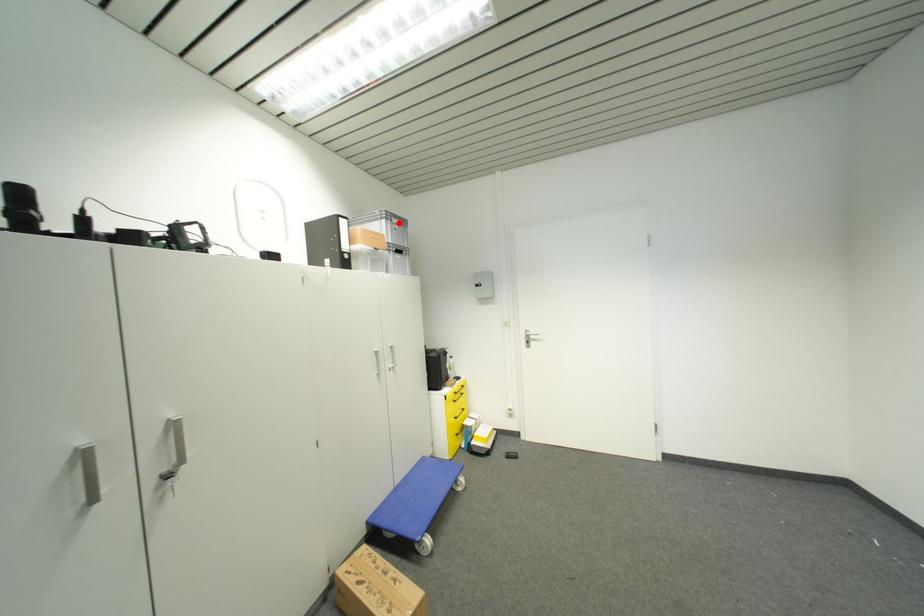
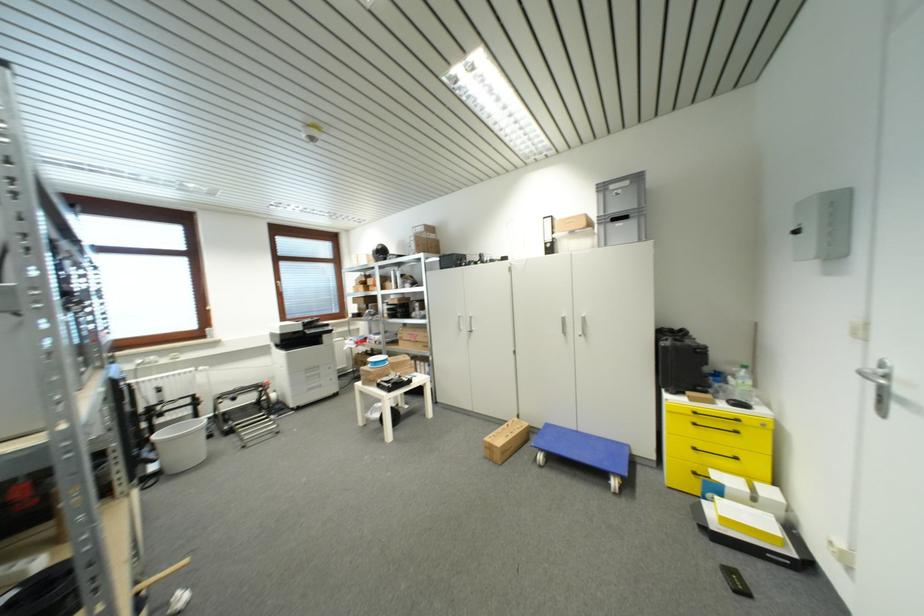
Locate, in the second image, the point that corresponds to the highlighted location in the first image.

(616, 190)